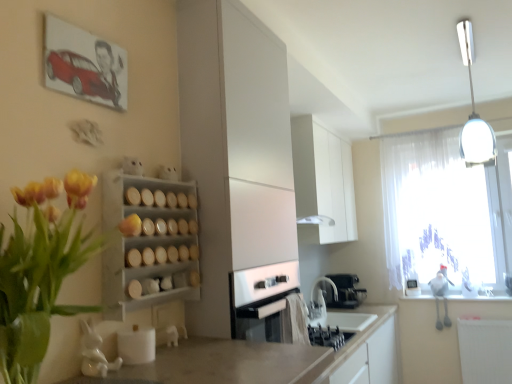
Image resolution: width=512 pixels, height=384 pixels. What are the coordinates of `white glossy cabinet at upper center, which appears as the 1th cabinetry when viewed from the right` in the screenshot? It's located at (322, 183).

What do you see at coordinates (149, 242) in the screenshot?
I see `white matte spice rack at center-left` at bounding box center [149, 242].

This screenshot has width=512, height=384. Describe the element at coordinates (40, 272) in the screenshot. I see `yellow tulip bouquet at left` at that location.

Where is `yellow matte flower at upper left`? The width and height of the screenshot is (512, 384). yellow matte flower at upper left is located at coordinates (130, 225).

From the image's perspective, is yellow tulip bouquet at left on top of yellow matte flower at upper left?

No, from the image's perspective, yellow tulip bouquet at left is not above yellow matte flower at upper left.

Is yellow matte flower at upper left surrounded by yellow tulip bouquet at left?

No, yellow matte flower at upper left is located outside of yellow tulip bouquet at left.

Based on their sizes in the image, would you say yellow tulip bouquet at left is bigger or smaller than yellow matte flower at upper left?

In the image, yellow tulip bouquet at left appears to be larger than yellow matte flower at upper left.

Is yellow tulip bouquet at left placed right next to yellow matte flower at upper left?

No.

Between white matte radiator at lower right and black matte coffee machine at lower center, which one has larger size?

With larger size is white matte radiator at lower right.

From the image's perspective, who appears lower, white matte radiator at lower right or black matte coffee machine at lower center?

From the image's view, white matte radiator at lower right is below.

Who is taller, white matte radiator at lower right or black matte coffee machine at lower center?

Standing taller between the two is white matte radiator at lower right.

Can we say white matte radiator at lower right lies outside black matte coffee machine at lower center?

white matte radiator at lower right lies outside black matte coffee machine at lower center's area.

From the picture: Does white glossy cabinet at upper center, which appears as the 1th cabinetry when viewed from the right, have a lesser width compared to white glossy light fixture at upper right?

Indeed, white glossy cabinet at upper center, which appears as the 1th cabinetry when viewed from the right, has a lesser width compared to white glossy light fixture at upper right.

In the scene shown: Which is nearer, [321,243] or [490,148]?

The point [490,148] is in front.

In order to click on light fixture on the right of white glossy cabinet at upper center, which appears as the 1th cabinetry when viewed from the right in this screenshot , I will do `click(474, 112)`.

Would you say white matte spice rack at center-left is to the left or to the right of transparent fabric at upper right in the picture?

Based on their positions, white matte spice rack at center-left is located to the left of transparent fabric at upper right.

Is white matte spice rack at center-left situated inside transparent fabric at upper right or outside?

white matte spice rack at center-left is spatially situated outside transparent fabric at upper right.

Is white matte spice rack at center-left not close to transparent fabric at upper right?

white matte spice rack at center-left is positioned a significant distance from transparent fabric at upper right.

From the image's perspective, between white matte spice rack at center-left and transparent fabric at upper right, which one is located above?

white matte spice rack at center-left.

Is white glossy light fixture at upper right taller or shorter than white matte radiator at lower right?

white glossy light fixture at upper right is taller than white matte radiator at lower right.

From the image's perspective, relative to white matte radiator at lower right, is white glossy light fixture at upper right above or below?

white glossy light fixture at upper right is situated higher than white matte radiator at lower right in the image.

From a real-world perspective, is white glossy light fixture at upper right located beneath white matte radiator at lower right?

No, from a real-world perspective, white glossy light fixture at upper right is not under white matte radiator at lower right.

Is point (463, 138) farther from viewer compared to point (485, 324)?

No, it is in front of (485, 324).

Is transparent fabric at upper right looking in the opposite direction of yellow tulip bouquet at left?

transparent fabric at upper right is not turned away from yellow tulip bouquet at left.

Is transparent fabric at upper right wider than yellow tulip bouquet at left?

No, transparent fabric at upper right is not wider than yellow tulip bouquet at left.

Identify the location of floral arrangement below the transparent fabric at upper right (from a real-world perspective). (40, 272).

Is transparent fabric at upper right further to the viewer compared to yellow tulip bouquet at left?

Yes, the depth of transparent fabric at upper right is greater than that of yellow tulip bouquet at left.

Is white matte spice rack at center-left next to white glossy light fixture at upper right?

No.

Who is bigger, white matte spice rack at center-left or white glossy light fixture at upper right?

Bigger between the two is white glossy light fixture at upper right.

What's the angular difference between white matte spice rack at center-left and white glossy light fixture at upper right's facing directions?

88 degrees.

Choose the correct answer: Is white matte spice rack at center-left inside white glossy light fixture at upper right or outside it?

white matte spice rack at center-left exists outside the volume of white glossy light fixture at upper right.

This screenshot has width=512, height=384. Identify the location of flower on the right side of yellow tulip bouquet at left. (130, 225).

You are a GUI agent. You are given a task and a screenshot of the screen. Output one action in this format:
    pyautogui.click(x=<x>, y=<y>)
    Task: Click on the coffee machine on the left of white matte radiator at lower right
    The height and width of the screenshot is (384, 512).
    Given the screenshot: What is the action you would take?
    pyautogui.click(x=345, y=291)

Considering their positions, is white glossy light fixture at upper right positioned further to transparent fabric at upper right than white matte spice rack at center-left?

Among the two, white matte spice rack at center-left is located further to transparent fabric at upper right.

When comparing their distances from white matte cabinet at center, acting as the 1th cabinetry starting from the front, does yellow tulip bouquet at left or yellow matte flower at upper left seem closer?

The object closer to white matte cabinet at center, acting as the 1th cabinetry starting from the front, is yellow matte flower at upper left.

Considering their positions, is white glossy light fixture at upper right positioned closer to white matte spice rack at center-left than transparent fabric at upper right?

The object closer to white matte spice rack at center-left is white glossy light fixture at upper right.

Based on the photo, considering their positions, is white matte radiator at lower right positioned further to white matte spice rack at center-left than white glossy light fixture at upper right?

white matte radiator at lower right.

Estimate the real-world distances between objects in this image. Which object is further from white matte radiator at lower right, yellow matte flower at upper left or white matte cabinet at center, placed as the 2th cabinetry when sorted from back to front?

yellow matte flower at upper left is positioned further to the anchor white matte radiator at lower right.

Which object lies further to the anchor point black matte coffee machine at lower center, white glossy light fixture at upper right or white matte cabinet at center, acting as the 1th cabinetry starting from the front?

white matte cabinet at center, acting as the 1th cabinetry starting from the front, is positioned further to the anchor black matte coffee machine at lower center.

Looking at the image, which one is located further to white glossy cabinet at upper center, the second cabinetry positioned from the left, white matte cabinet at center, acting as the 1th cabinetry starting from the front, or yellow matte flower at upper left?

yellow matte flower at upper left is positioned further to the anchor white glossy cabinet at upper center, the second cabinetry positioned from the left.

Considering their positions, is black matte coffee machine at lower center positioned further to white glossy light fixture at upper right than white matte spice rack at center-left?

black matte coffee machine at lower center is further to white glossy light fixture at upper right.

Locate an element on the screen. shelf between yellow tulip bouquet at left and white glossy light fixture at upper right in the horizontal direction is located at coordinates (149, 242).

Where is `light fixture between white matte spice rack at center-left and transparent fabric at upper right from front to back`? The height and width of the screenshot is (384, 512). light fixture between white matte spice rack at center-left and transparent fabric at upper right from front to back is located at coordinates (474, 112).

The width and height of the screenshot is (512, 384). What are the coordinates of `coffee machine between white glossy light fixture at upper right and white matte radiator at lower right from top to bottom` in the screenshot? It's located at (345, 291).

The image size is (512, 384). In order to click on radiator between yellow matte flower at upper left and black matte coffee machine at lower center in the front-back direction in this screenshot , I will do `click(485, 350)`.